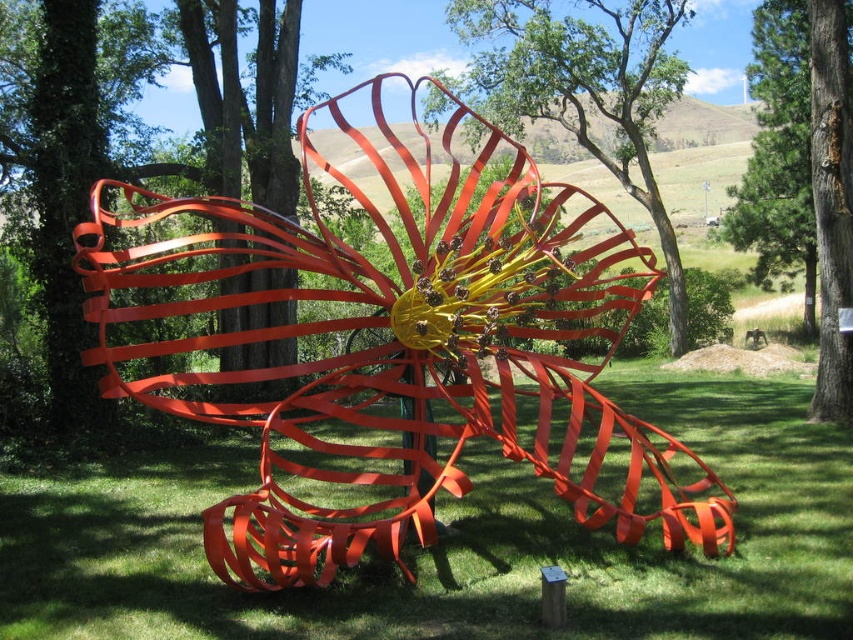
Question: Does glossy orange sculpture at center appear under green leafy tree at center?

Choices:
 (A) yes
 (B) no

Answer: (A)

Question: Can you confirm if green textured tree at upper right is positioned below smooth bark tree at center?

Choices:
 (A) yes
 (B) no

Answer: (B)

Question: Based on their relative distances, which object is farther from the smooth bark tree at center?

Choices:
 (A) metallic red ribbon at center
 (B) green textured tree at upper right

Answer: (B)

Question: Which point is closer to the camera?

Choices:
 (A) green textured tree at upper right
 (B) green leafy tree at center
 (C) metallic red ribbon at center
 (D) smooth bark tree at center

Answer: (C)

Question: Does green leafy tree at center appear on the left side of green textured tree at upper right?

Choices:
 (A) yes
 (B) no

Answer: (A)

Question: Which object is the farthest from the smooth bark tree at center?

Choices:
 (A) metallic red ribbon at center
 (B) green textured tree at upper right
 (C) green leafy tree at center

Answer: (B)